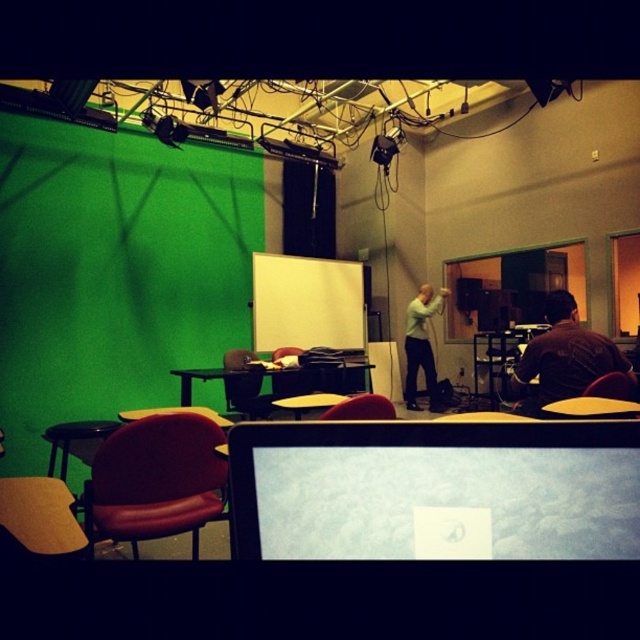
You are standing in the studio and want to move from the laptop to the whiteboard. The path goes through two points marked as point (545, 340) and point (412, 326). Which point should you step on first?

Point (545, 340) is in front of point (412, 326), so you should step on point (545, 340) first.

You are an assistant in the studio and need to adjust the lighting for a photo shoot. You notice the brown fabric shirt at right and the light gray sweater at center. Which clothing item is closer to the camera?

The brown fabric shirt at right is closer to the camera because it is in front of the light gray sweater at center.